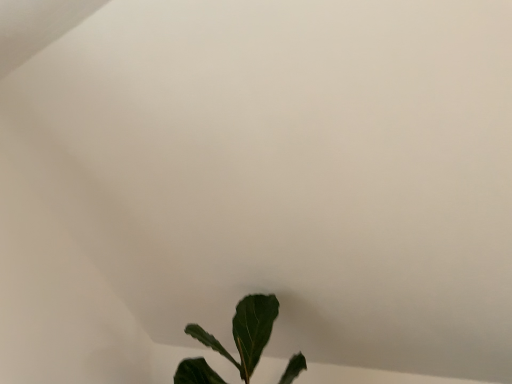
I want to click on green matte leafy plant at lower center, so click(245, 332).

The height and width of the screenshot is (384, 512). What do you see at coordinates (245, 332) in the screenshot?
I see `green matte leafy plant at lower center` at bounding box center [245, 332].

Find the location of a particular element. green matte leafy plant at lower center is located at coordinates (245, 332).